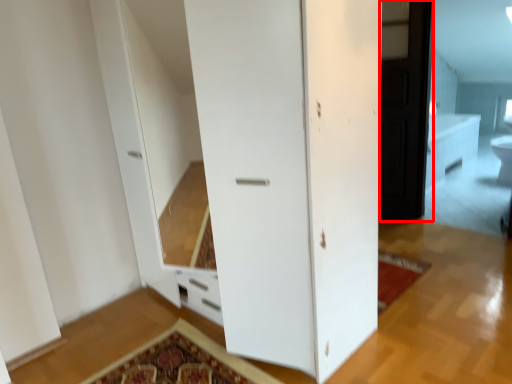
Question: From the image's perspective, where is screen door (annotated by the red box) located in relation to toilet bowl in the image?

Choices:
 (A) below
 (B) above

Answer: (B)